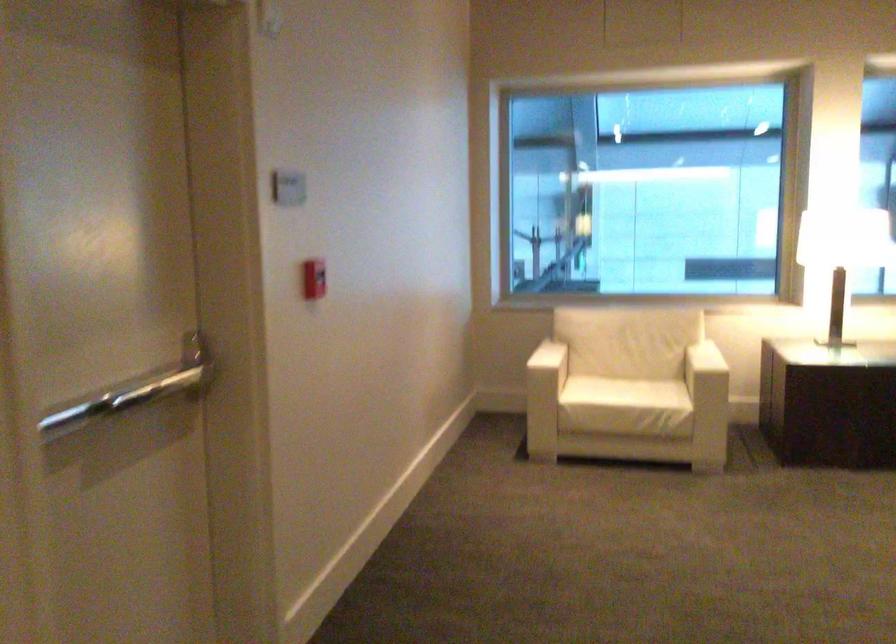
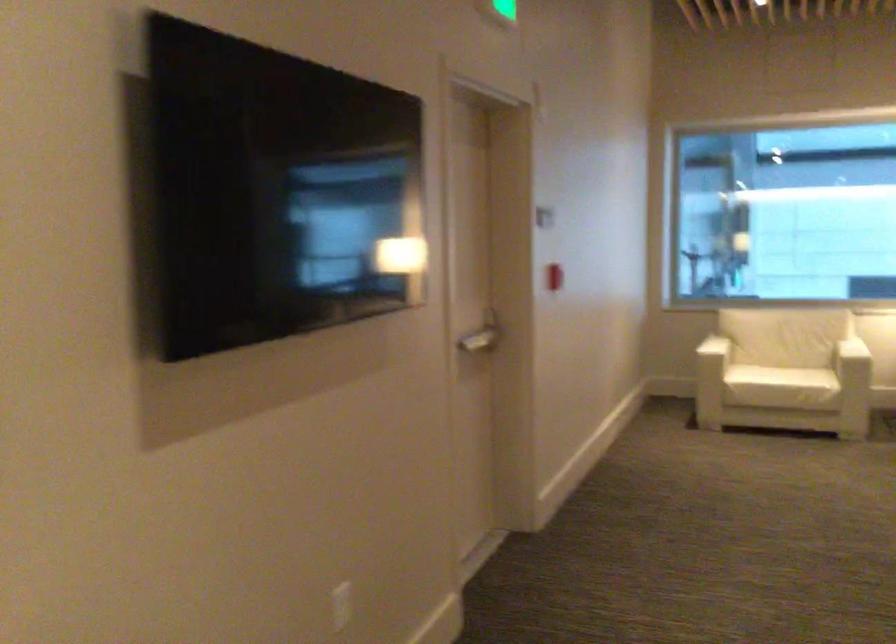
Locate, in the second image, the point that corresponds to point 300,308 in the first image.

(554, 277)